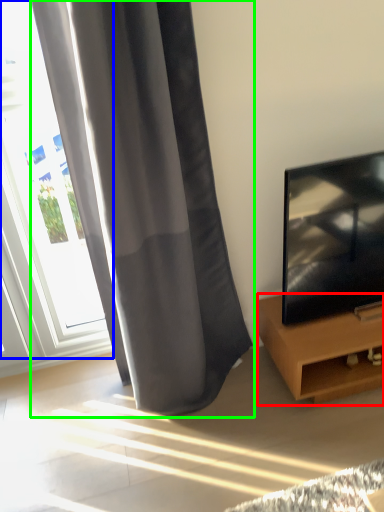
Question: Based on their relative distances, which object is nearer to furniture (highlighted by a red box)? Choose from window (highlighted by a blue box) and curtain (highlighted by a green box).

Choices:
 (A) window
 (B) curtain

Answer: (B)